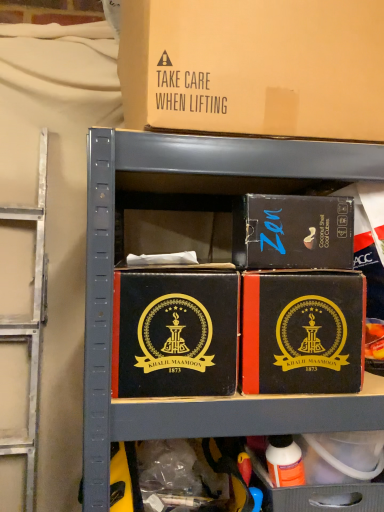
Question: Is matte black box at center, acting as the 1th box starting from the bottom, wider than brown cardboard box at upper center, which appears as the first box when viewed from the top?

Choices:
 (A) no
 (B) yes

Answer: (B)

Question: From the image's perspective, does matte black box at center, acting as the 1th box starting from the bottom, appear higher than brown cardboard box at upper center, which appears as the first box when viewed from the top?

Choices:
 (A) no
 (B) yes

Answer: (A)

Question: Can you confirm if matte black box at center, placed as the fourth box when sorted from top to bottom, is thinner than brown cardboard box at upper center, which is the fourth box in bottom-to-top order?

Choices:
 (A) yes
 (B) no

Answer: (B)

Question: Can you confirm if matte black box at center, placed as the fourth box when sorted from top to bottom, is positioned to the right of brown cardboard box at upper center, which appears as the first box when viewed from the top?

Choices:
 (A) no
 (B) yes

Answer: (B)

Question: Is the depth of matte black box at center, placed as the fourth box when sorted from top to bottom, less than that of brown cardboard box at upper center, which appears as the first box when viewed from the top?

Choices:
 (A) yes
 (B) no

Answer: (B)

Question: Is brown cardboard box at upper center, which appears as the first box when viewed from the top, inside or outside of black leather box at center, positioned as the third box in top-to-bottom order?

Choices:
 (A) outside
 (B) inside

Answer: (A)

Question: Relative to black leather box at center, which is the 2th box from bottom to top, is brown cardboard box at upper center, which appears as the first box when viewed from the top, in front or behind?

Choices:
 (A) behind
 (B) front

Answer: (B)

Question: From the image's perspective, is brown cardboard box at upper center, which appears as the first box when viewed from the top, above or below black leather box at center, positioned as the third box in top-to-bottom order?

Choices:
 (A) below
 (B) above

Answer: (B)

Question: Visually, is brown cardboard box at upper center, which is the fourth box in bottom-to-top order, positioned to the left or to the right of black leather box at center, positioned as the third box in top-to-bottom order?

Choices:
 (A) right
 (B) left

Answer: (A)

Question: Considering the positions of matte black box at center, acting as the 1th box starting from the bottom, and black leather box at center, positioned as the third box in top-to-bottom order, in the image, is matte black box at center, acting as the 1th box starting from the bottom, bigger or smaller than black leather box at center, positioned as the third box in top-to-bottom order,?

Choices:
 (A) small
 (B) big

Answer: (A)

Question: In the image, is matte black box at center, acting as the 1th box starting from the bottom, positioned in front of or behind black leather box at center, positioned as the third box in top-to-bottom order?

Choices:
 (A) front
 (B) behind

Answer: (B)

Question: From a real-world perspective, is matte black box at center, placed as the fourth box when sorted from top to bottom, physically located above or below black leather box at center, positioned as the third box in top-to-bottom order?

Choices:
 (A) above
 (B) below

Answer: (B)

Question: Is matte black box at center, placed as the fourth box when sorted from top to bottom, taller or shorter than black leather box at center, which is the 2th box from bottom to top?

Choices:
 (A) short
 (B) tall

Answer: (B)

Question: In terms of height, does brown cardboard box at upper center, which is the fourth box in bottom-to-top order, look taller or shorter compared to matte black box at upper right, arranged as the second box when viewed from the top?

Choices:
 (A) tall
 (B) short

Answer: (A)

Question: Looking at the image, does brown cardboard box at upper center, which appears as the first box when viewed from the top, seem bigger or smaller compared to matte black box at upper right, arranged as the second box when viewed from the top?

Choices:
 (A) small
 (B) big

Answer: (B)